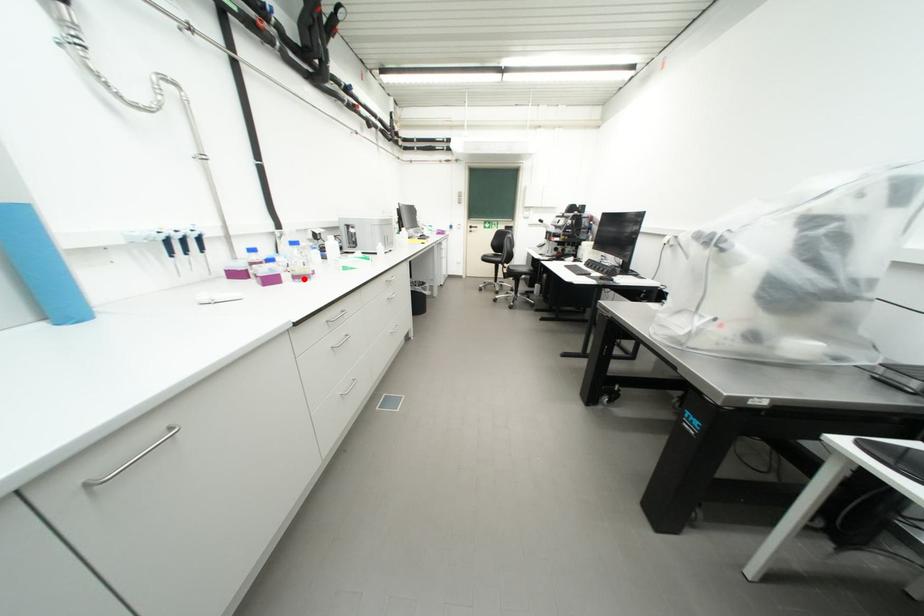
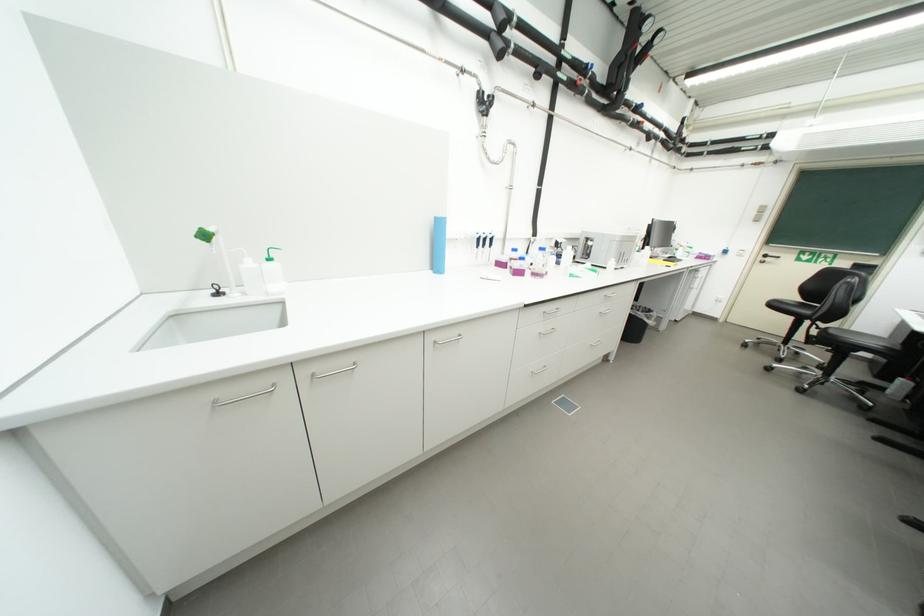
Find the pixel in the second image that matches the highlighted location in the first image.

(541, 276)